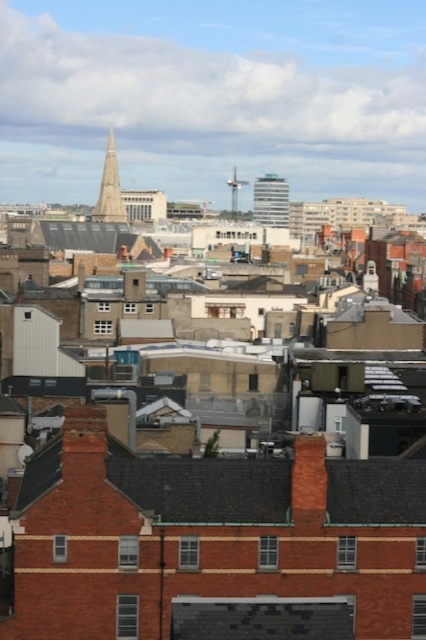
You are standing in the urban landscape and need to locate the red brick roof at lower left. According to the coordinates provided, where exactly is it positioned?

The red brick roof at lower left is located at point [206,488].

You are an urban planner assessing the city layout. You notice the white glass building at center and the shiny silver spire at center. Which structure has a greater width?

The white glass building at center has a greater width than the shiny silver spire at center.